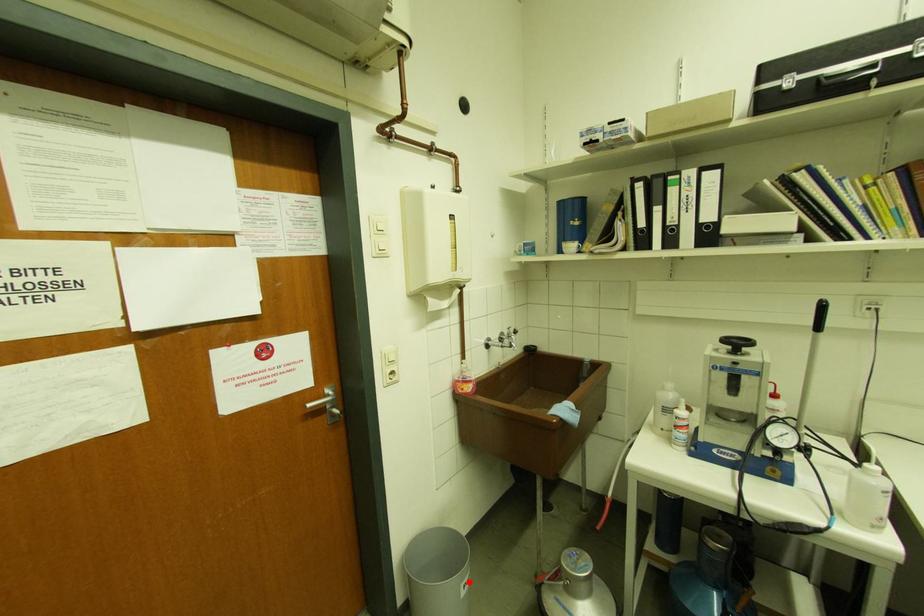
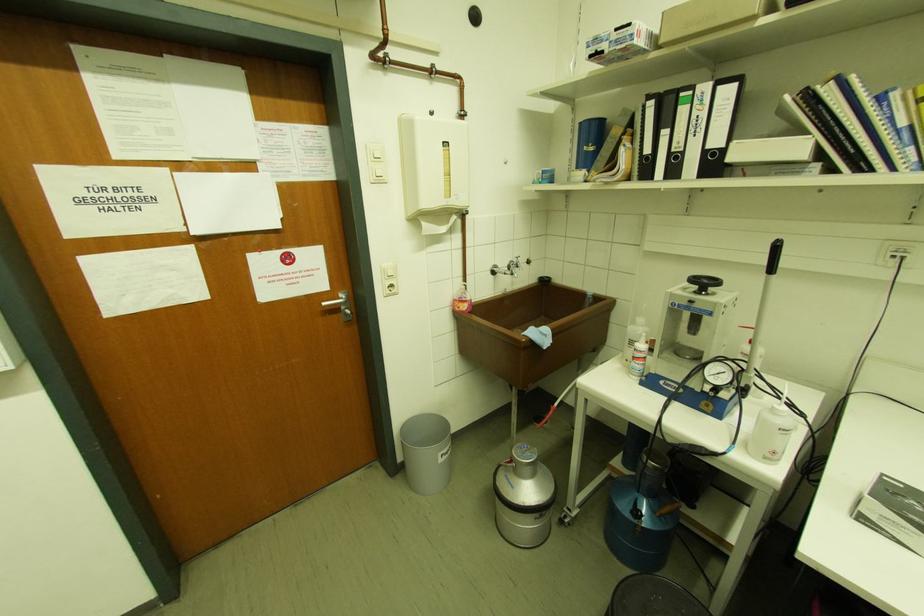
Where in the second image is the point corresponding to the highlighted location from the first image?

(446, 453)